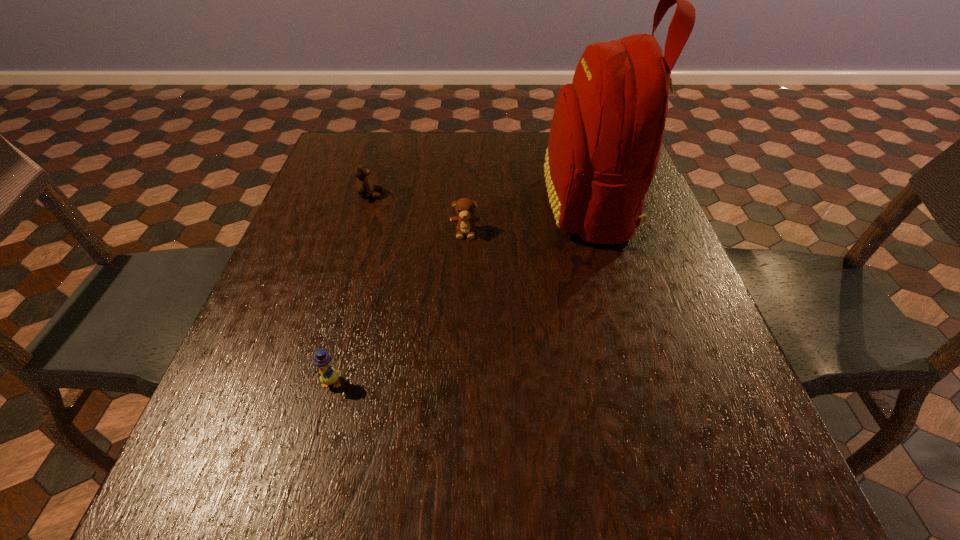
In order to click on the rightmost object in this screenshot , I will do `click(607, 129)`.

Locate an element on the screen. backpack is located at coordinates (607, 129).

Identify the location of the farther teddy bear. (364, 186).

You are a GUI agent. You are given a task and a screenshot of the screen. Output one action in this format:
    pyautogui.click(x=<x>, y=<y>)
    Task: Click on the third object from left to right
    
    Given the screenshot: What is the action you would take?
    pyautogui.click(x=465, y=207)

You are a GUI agent. You are given a task and a screenshot of the screen. Output one action in this format:
    pyautogui.click(x=<x>, y=<y>)
    Task: Click on the nearer teddy bear
    Image resolution: width=960 pixels, height=540 pixels.
    Given the screenshot: What is the action you would take?
    pyautogui.click(x=465, y=207)

Find the location of a particular element. the nearest object is located at coordinates (329, 376).

Find the location of a particular element. This screenshot has width=960, height=540. vacant position located 0.350m on the front-facing side of the rightmost object is located at coordinates (407, 204).

In order to click on free space located on the front-facing side of the rightmost object in this screenshot , I will do `click(430, 204)`.

Locate an element on the screen. free space located 0.240m on the front-facing side of the rightmost object is located at coordinates (450, 204).

Where is `vacant region located at the face of the left teddy bear`? vacant region located at the face of the left teddy bear is located at coordinates (463, 194).